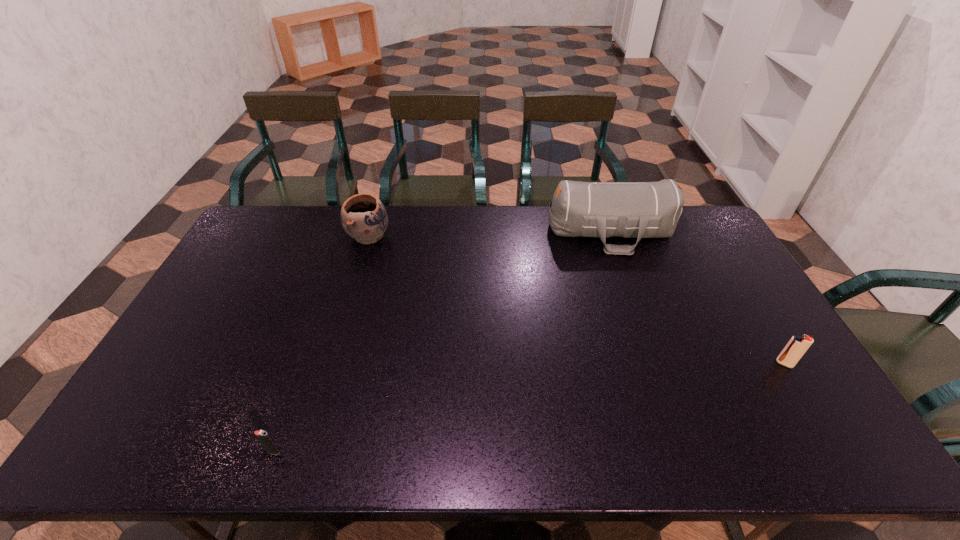
Identify the location of vacant space at the right edge of the desktop. The image size is (960, 540). (729, 296).

Locate an element on the screen. vacant space that is in between the duffel bag and the left igniter is located at coordinates (443, 342).

The image size is (960, 540). What are the coordinates of `vacant point located between the farther igniter and the third object from left to right` in the screenshot? It's located at (698, 298).

The height and width of the screenshot is (540, 960). I want to click on vacant area that lies between the shortest object and the farther igniter, so click(x=529, y=408).

Identify the location of vacant point located between the third shortest object and the right igniter. The image size is (960, 540). (576, 300).

The height and width of the screenshot is (540, 960). Identify the location of free space between the nearer igniter and the second nearest object. (529, 408).

This screenshot has width=960, height=540. Find the location of `free spot between the third shortest object and the nearer igniter`. free spot between the third shortest object and the nearer igniter is located at coordinates (321, 344).

Find the location of `empty space between the left igniter and the duffel bag`. empty space between the left igniter and the duffel bag is located at coordinates (443, 342).

Locate an element on the screen. The image size is (960, 540). unoccupied area between the nearest object and the pottery is located at coordinates (321, 344).

Locate an element on the screen. free space between the second tallest object and the second object from right to left is located at coordinates (490, 234).